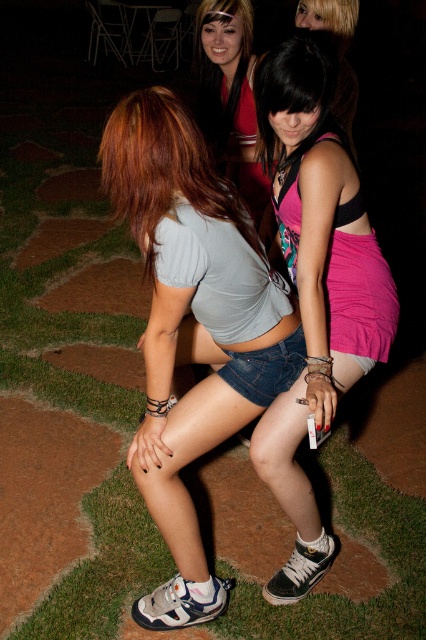
Looking at the two outfits in the scene, the matte gray shirt at center and the matte red dress at upper center, which one is positioned to the left?

The matte gray shirt at center is to the left of the matte red dress at upper center.

You are a photographer trying to adjust the lighting for a photo shoot. You notice the matte gray shirt at center and the matte red dress at upper center. Which clothing item appears taller in the photo?

The matte gray shirt at center appears taller than the matte red dress at upper center in the photo.

Based on the photo, what is the color of the shirt at the point specified by the coordinates (192, 326)?

The point at coordinates (192, 326) is on the matte gray shirt at center, so the color is matte gray.